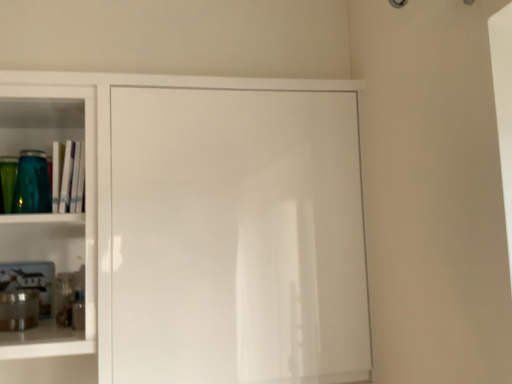
Image resolution: width=512 pixels, height=384 pixels. I want to click on hardcover book at left, so click(x=73, y=178).

What do you see at coordinates (73, 178) in the screenshot? I see `hardcover book at left` at bounding box center [73, 178].

At what (x,y) coordinates should I click in order to perform the action: click on hardcover book at left. Please return your answer as a coordinate pair (x, y). Looking at the image, I should click on point(73,178).